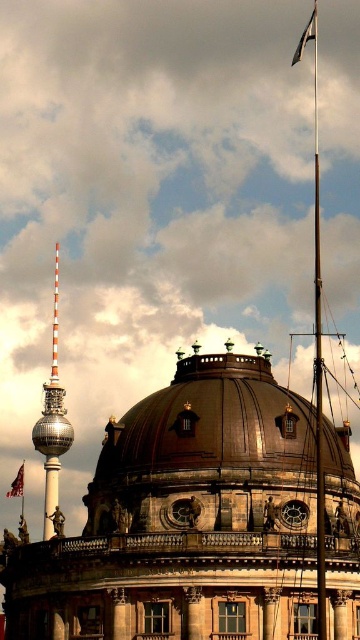
Question: Is white fabric flag at upper right in front of metallic flag pole at upper center?

Choices:
 (A) yes
 (B) no

Answer: (B)

Question: Which point is closer to the camera?

Choices:
 (A) (23, 481)
 (B) (348, 476)
 (C) (51, 445)

Answer: (B)

Question: Does red fabric flag at upper center appear on the left side of metallic flag pole at upper center?

Choices:
 (A) no
 (B) yes

Answer: (B)

Question: Which point is farther to the camera?

Choices:
 (A) metallic flag pole at upper center
 (B) silver metallic tower at center-left
 (C) white fabric flag at upper right
 (D) red fabric flag at upper center

Answer: (C)

Question: Does silver metallic tower at center-left have a lesser width compared to metallic flag pole at upper center?

Choices:
 (A) yes
 (B) no

Answer: (B)

Question: Which point is farther to the camera?

Choices:
 (A) (128, 422)
 (B) (11, 486)
 (C) (48, 529)

Answer: (B)